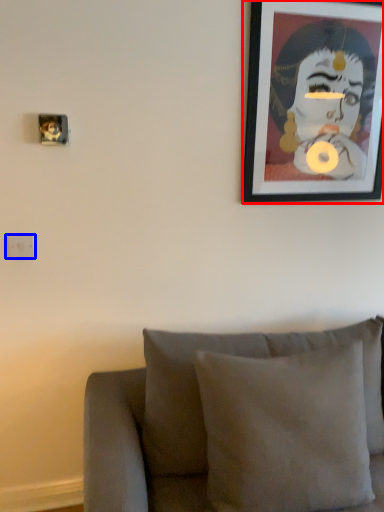
Question: Among these objects, which one is nearest to the camera, picture frame (highlighted by a red box) or electric outlet (highlighted by a blue box)?

Choices:
 (A) picture frame
 (B) electric outlet

Answer: (A)